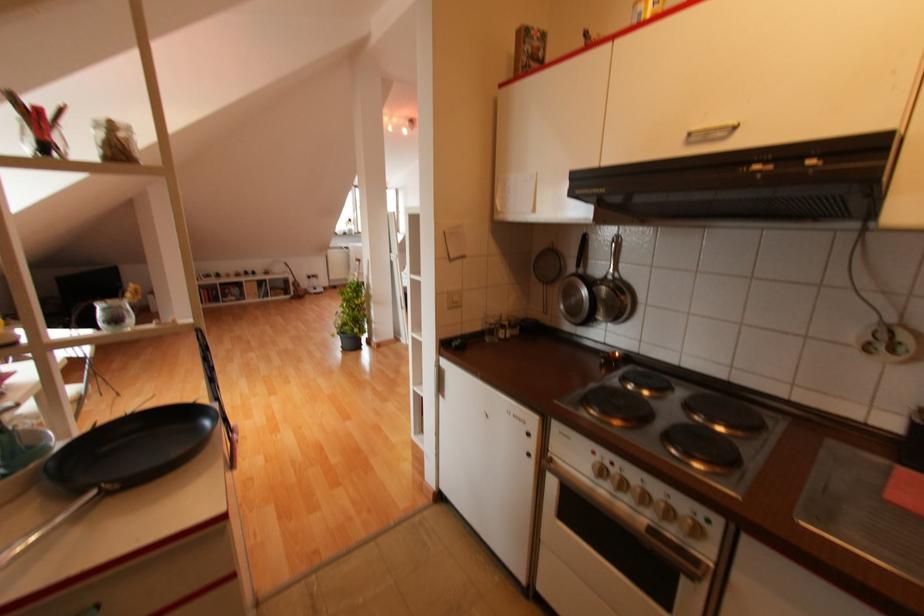
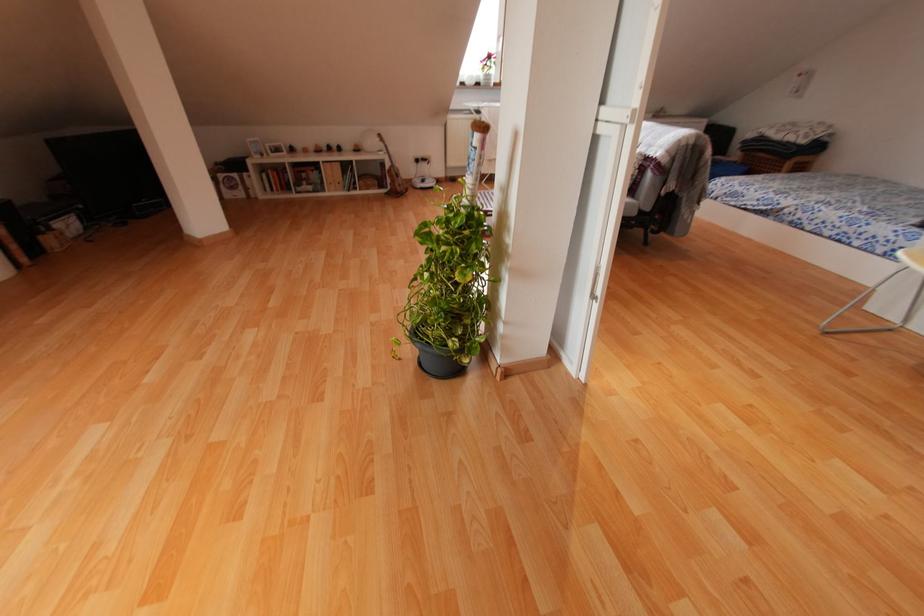
Question: In a continuous first-person perspective shot, in which direction is the camera moving?

Choices:
 (A) Left
 (B) Right
 (C) Forward
 (D) Backward

Answer: (C)